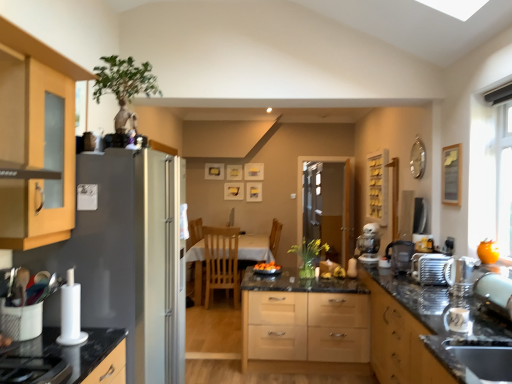
Question: Is wooden picture frame at center, positioned as the 1th picture frame in back-to-front order, positioned before white glossy table at center?

Choices:
 (A) no
 (B) yes

Answer: (A)

Question: From a real-world perspective, is wooden picture frame at center, positioned as the 1th picture frame in back-to-front order, physically below white glossy table at center?

Choices:
 (A) no
 (B) yes

Answer: (A)

Question: Is the depth of wooden picture frame at center, positioned as the 1th picture frame in back-to-front order, greater than that of white glossy table at center?

Choices:
 (A) yes
 (B) no

Answer: (A)

Question: Is wooden picture frame at center, which is the 1th picture frame in left-to-right order, positioned far away from white glossy table at center?

Choices:
 (A) no
 (B) yes

Answer: (B)

Question: Can white glossy table at center be found inside wooden picture frame at center, which is the third picture frame from right to left?

Choices:
 (A) yes
 (B) no

Answer: (B)

Question: Considering the relative sizes of wooden picture frame at center, which is the 1th picture frame in left-to-right order, and white glossy table at center in the image provided, is wooden picture frame at center, which is the 1th picture frame in left-to-right order, wider than white glossy table at center?

Choices:
 (A) yes
 (B) no

Answer: (B)

Question: Does satin silver toaster at right, positioned as the 2th appliance in front-to-back order, have a lesser width compared to satin silver sink at lower right?

Choices:
 (A) yes
 (B) no

Answer: (A)

Question: Is satin silver toaster at right, positioned as the 1th appliance in right-to-left order, oriented towards satin silver sink at lower right?

Choices:
 (A) yes
 (B) no

Answer: (B)

Question: Is satin silver toaster at right, which appears as the 2th appliance when viewed from the back, wider than satin silver sink at lower right?

Choices:
 (A) yes
 (B) no

Answer: (B)

Question: Is satin silver toaster at right, the third appliance viewed from the left, further to camera compared to satin silver sink at lower right?

Choices:
 (A) yes
 (B) no

Answer: (A)

Question: From a real-world perspective, is satin silver toaster at right, positioned as the 1th appliance in right-to-left order, positioned over satin silver sink at lower right based on gravity?

Choices:
 (A) no
 (B) yes

Answer: (B)

Question: Considering the relative positions of satin silver toaster at right, positioned as the 2th appliance in front-to-back order, and satin silver sink at lower right in the image provided, is satin silver toaster at right, positioned as the 2th appliance in front-to-back order, in front of satin silver sink at lower right?

Choices:
 (A) no
 (B) yes

Answer: (A)

Question: From a real-world perspective, does orange matte bowl at center stand above satin silver toaster at right?

Choices:
 (A) yes
 (B) no

Answer: (B)